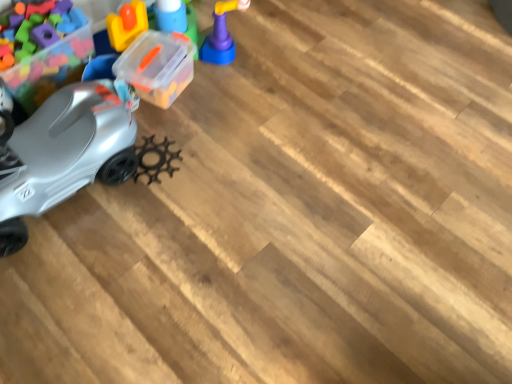
Question: Is matte purple toy at upper center, which appears as the 3th toy when viewed from the left, to the right of silver matte car at left, the second toy when ordered from right to left, from the viewer's perspective?

Choices:
 (A) yes
 (B) no

Answer: (A)

Question: Is silver matte car at left, the 2th toy positioned from the left, located within matte purple toy at upper center, which appears as the 1th toy when viewed from the right?

Choices:
 (A) no
 (B) yes

Answer: (A)

Question: From the image's perspective, is matte purple toy at upper center, which appears as the 1th toy when viewed from the right, on top of silver matte car at left, the 2th toy positioned from the left?

Choices:
 (A) yes
 (B) no

Answer: (A)

Question: Does matte purple toy at upper center, which appears as the 1th toy when viewed from the right, have a greater height compared to silver matte car at left, the 2th toy positioned from the left?

Choices:
 (A) no
 (B) yes

Answer: (A)

Question: Are matte purple toy at upper center, which appears as the 3th toy when viewed from the left, and silver matte car at left, the 2th toy positioned from the left, making contact?

Choices:
 (A) no
 (B) yes

Answer: (A)

Question: Is matte purple toy at upper center, which appears as the 1th toy when viewed from the right, smaller than silver matte car at left, the 2th toy positioned from the left?

Choices:
 (A) yes
 (B) no

Answer: (A)

Question: Is matte purple toy at upper center, which appears as the 1th toy when viewed from the right, not near metallic plastic car at left, acting as the 3th toy starting from the right?

Choices:
 (A) no
 (B) yes

Answer: (A)

Question: Considering the relative sizes of matte purple toy at upper center, which appears as the 1th toy when viewed from the right, and metallic plastic car at left, the first toy when ordered from left to right, in the image provided, is matte purple toy at upper center, which appears as the 1th toy when viewed from the right, taller than metallic plastic car at left, the first toy when ordered from left to right,?

Choices:
 (A) no
 (B) yes

Answer: (A)

Question: Is matte purple toy at upper center, which appears as the 1th toy when viewed from the right, at the right side of metallic plastic car at left, the first toy when ordered from left to right?

Choices:
 (A) yes
 (B) no

Answer: (A)

Question: Considering the relative sizes of matte purple toy at upper center, which appears as the 1th toy when viewed from the right, and metallic plastic car at left, the first toy when ordered from left to right, in the image provided, is matte purple toy at upper center, which appears as the 1th toy when viewed from the right, bigger than metallic plastic car at left, the first toy when ordered from left to right,?

Choices:
 (A) yes
 (B) no

Answer: (B)

Question: From a real-world perspective, is matte purple toy at upper center, which appears as the 3th toy when viewed from the left, on top of metallic plastic car at left, acting as the 3th toy starting from the right?

Choices:
 (A) yes
 (B) no

Answer: (B)

Question: From a real-world perspective, does matte purple toy at upper center, which appears as the 1th toy when viewed from the right, sit lower than metallic plastic car at left, the first toy when ordered from left to right?

Choices:
 (A) yes
 (B) no

Answer: (A)

Question: Is metallic plastic car at left, acting as the 3th toy starting from the right, at the right side of matte purple toy at upper center, which appears as the 3th toy when viewed from the left?

Choices:
 (A) yes
 (B) no

Answer: (B)